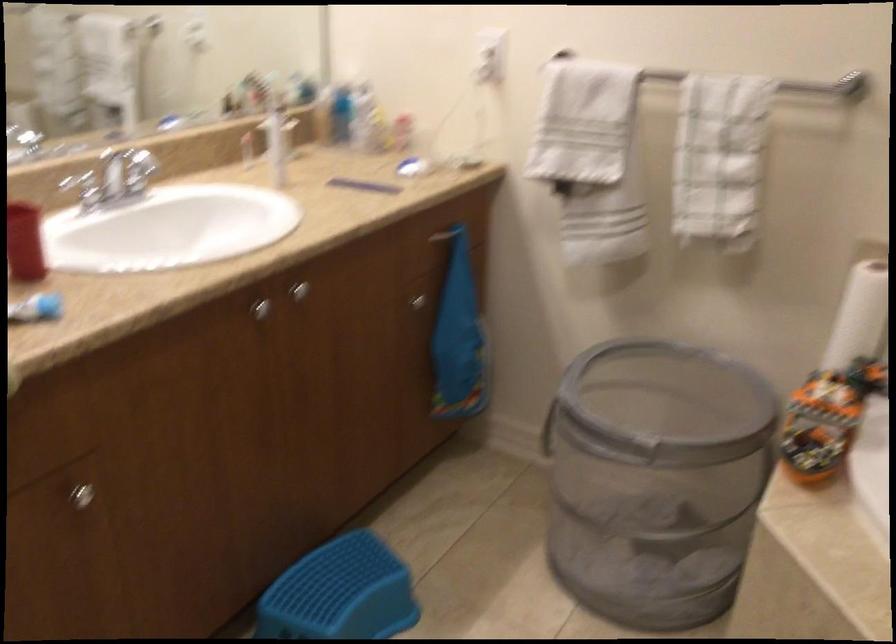
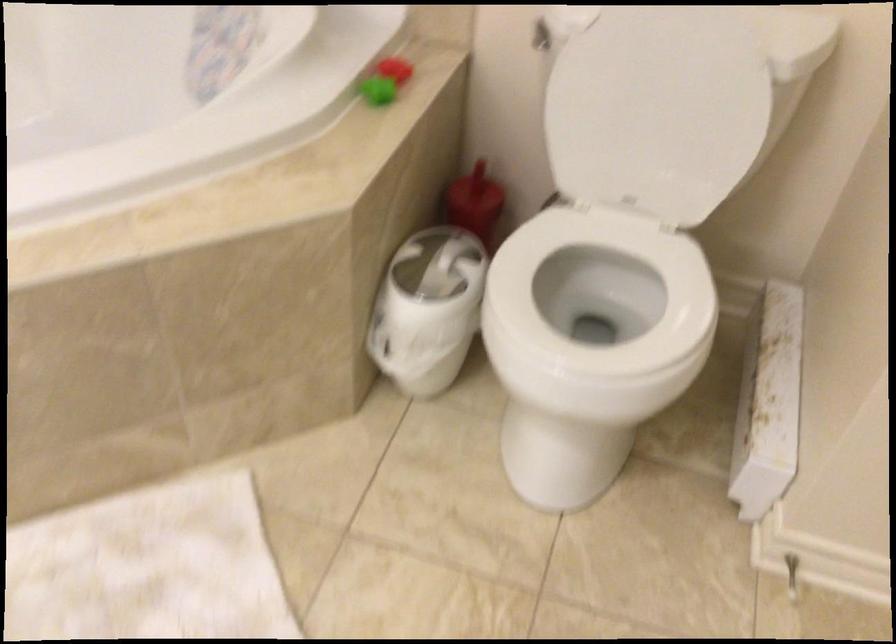
First-person continuous shooting, in which direction is the camera rotating?

The rotation direction of the camera is right-down.